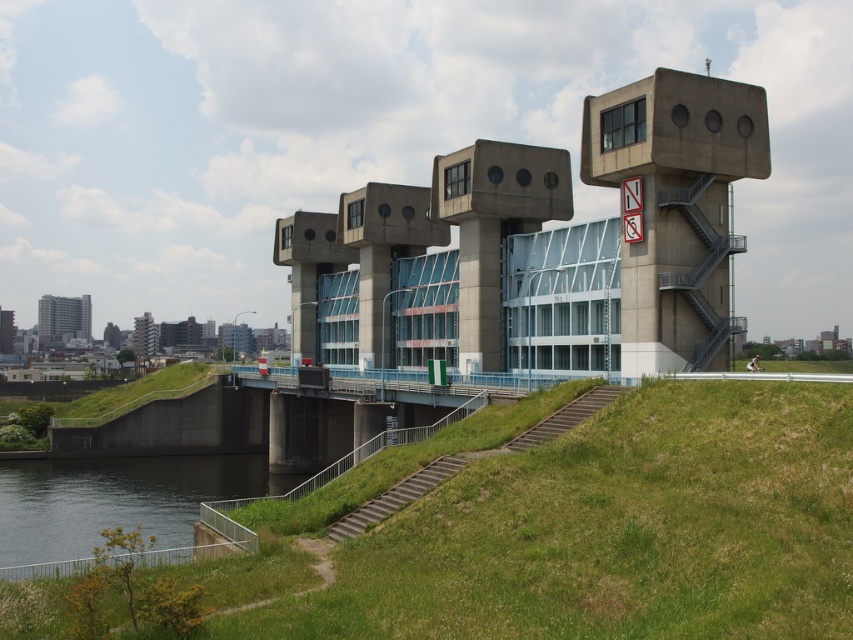
Can you confirm if green grassy at lower center is positioned below dark gray concrete river at lower left?

Incorrect, green grassy at lower center is not positioned below dark gray concrete river at lower left.

Is green grassy at lower center closer to the viewer compared to dark gray concrete river at lower left?

Yes.

Is point (489, 540) in front of point (25, 490)?

Yes, point (489, 540) is in front of point (25, 490).

The height and width of the screenshot is (640, 853). What are the coordinates of `green grassy at lower center` in the screenshot? It's located at (616, 531).

Can you confirm if concrete building at center is shorter than dark gray concrete river at lower left?

Incorrect, concrete building at center's height does not fall short of dark gray concrete river at lower left's.

Is concrete building at center above dark gray concrete river at lower left?

Correct, concrete building at center is located above dark gray concrete river at lower left.

Who is more distant from viewer, (572, 296) or (15, 532)?

Positioned behind is point (572, 296).

At what (x,y) coordinates should I click in order to perform the action: click on concrete building at center. Please return your answer as a coordinate pair (x, y). Looking at the image, I should click on (543, 246).

Between green grassy at lower center and concrete building at center, which one appears on the left side from the viewer's perspective?

From the viewer's perspective, green grassy at lower center appears more on the left side.

Can you confirm if green grassy at lower center is shorter than concrete building at center?

Correct, green grassy at lower center is not as tall as concrete building at center.

Is point (717, 410) positioned in front of point (445, 234)?

Yes.

The width and height of the screenshot is (853, 640). I want to click on green grassy at lower center, so click(616, 531).